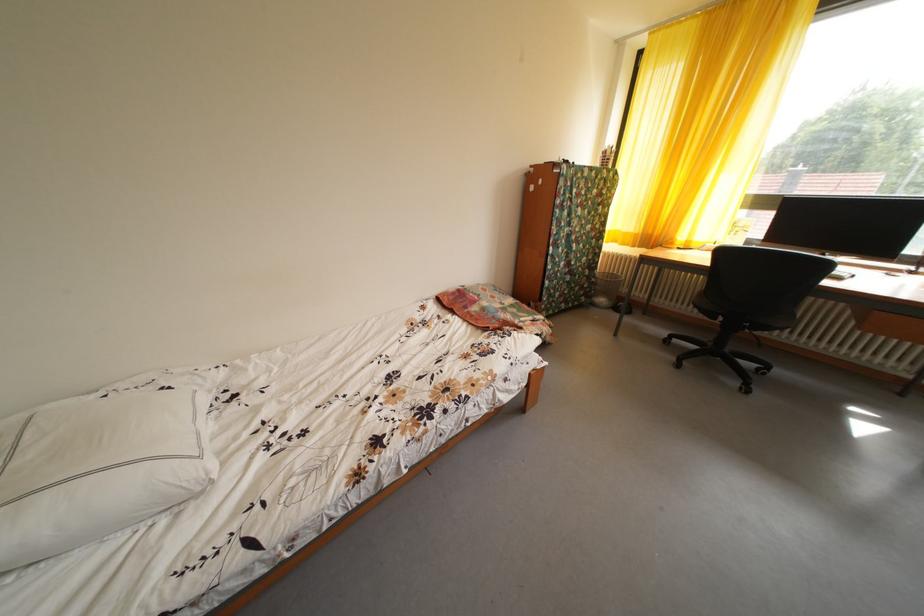
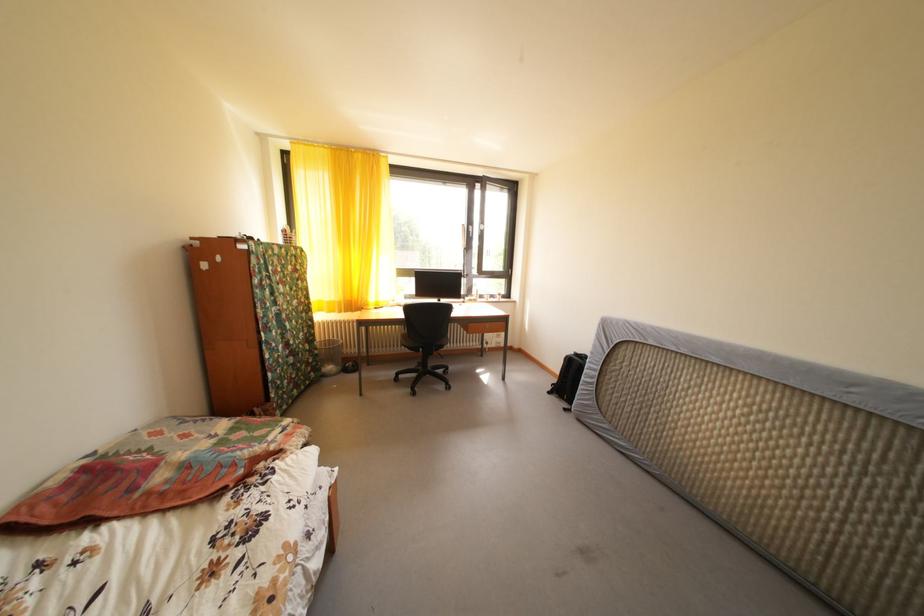
Where in the second image is the point corresponding to (x=597, y=283) from the first image?

(320, 357)